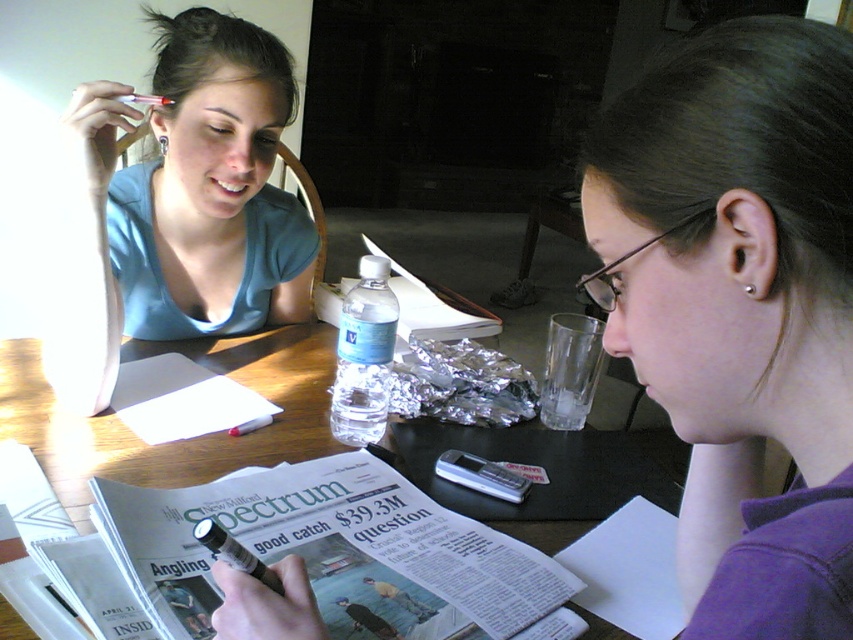
Question: Can you confirm if purple fabric shirt at lower right is positioned to the left of clear plastic water bottle at center?

Choices:
 (A) no
 (B) yes

Answer: (A)

Question: Does matte blue shirt at upper left lie in front of wooden table at center?

Choices:
 (A) no
 (B) yes

Answer: (A)

Question: Can you confirm if purple fabric shirt at lower right is smaller than clear plastic water bottle at center?

Choices:
 (A) yes
 (B) no

Answer: (B)

Question: Which of these objects is positioned farthest from the purple fabric shirt at lower right?

Choices:
 (A) wooden table at center
 (B) matte blue shirt at upper left

Answer: (B)

Question: Which point appears closest to the camera in this image?

Choices:
 (A) (669, 509)
 (B) (252, 221)

Answer: (A)

Question: Which object appears farthest from the camera in this image?

Choices:
 (A) matte blue shirt at upper left
 (B) wooden table at center
 (C) purple fabric shirt at lower right

Answer: (A)